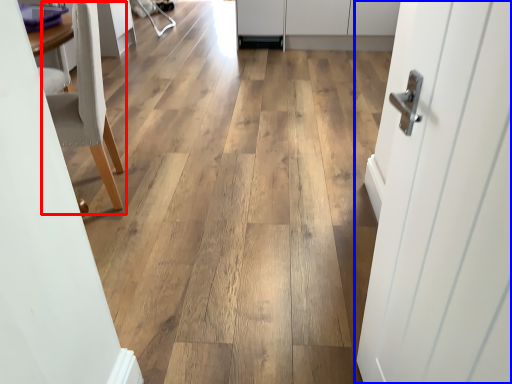
Question: Which point is further to the camera, chair (highlighted by a red box) or door (highlighted by a blue box)?

Choices:
 (A) chair
 (B) door

Answer: (A)